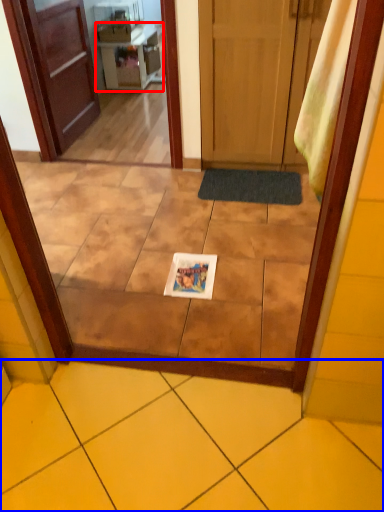
Question: Among these objects, which one is farthest to the camera, vanity (highlighted by a red box) or ceramic tile (highlighted by a blue box)?

Choices:
 (A) vanity
 (B) ceramic tile

Answer: (A)